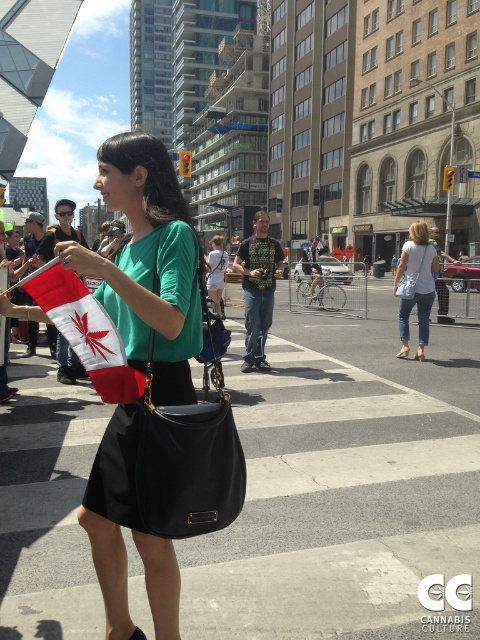
You are a photographer trying to capture a candid shot of the woman holding the Canadian flag. You notice two items at the center of your viewfinder, the white matte shorts at center and the black leather bag at center. Which item will appear bigger in your photo?

The white matte shorts at center will appear bigger in your photo since it is larger in size than the black leather bag at center.

You are a photographer standing at the pedestrian crossing and want to take a photo of the two points in the scene. The first point is at coordinates point (219, 296) and the second is at point (420, 268). Which point will appear closer to the camera in the photo?

Point (219, 296) will appear closer to the camera in the photo because it is further to the camera than point (420, 268).

You are a delivery robot positioned at the starting point. You need to deliver a package to the black leather bag at center. There is an obstacle, the white matte shorts at center, in your path. What is the minimum distance you must detour around the obstacle to reach the destination?

The white matte shorts at center is 9.72 feet away from the black leather bag at center. To detour around the obstacle, the delivery robot must go at least 9.72 feet around the white matte shorts at center to reach the black leather bag at center.